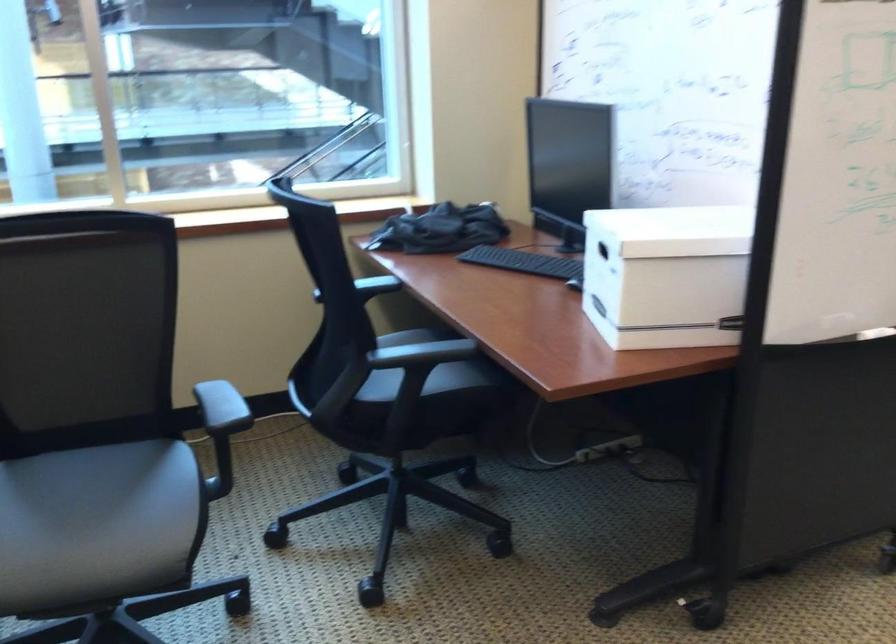
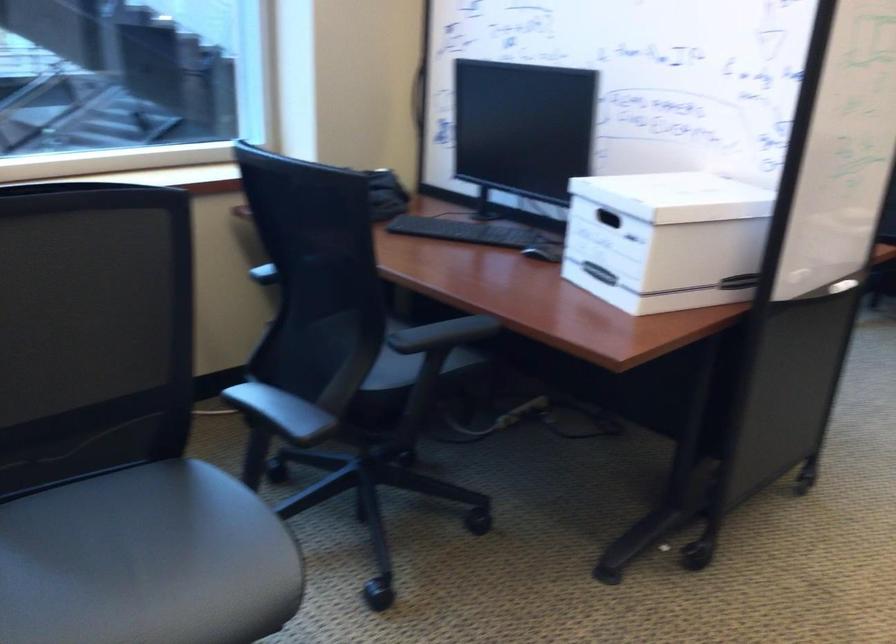
Find the pixel in the second image that matches [581,283] in the first image.

(544, 251)